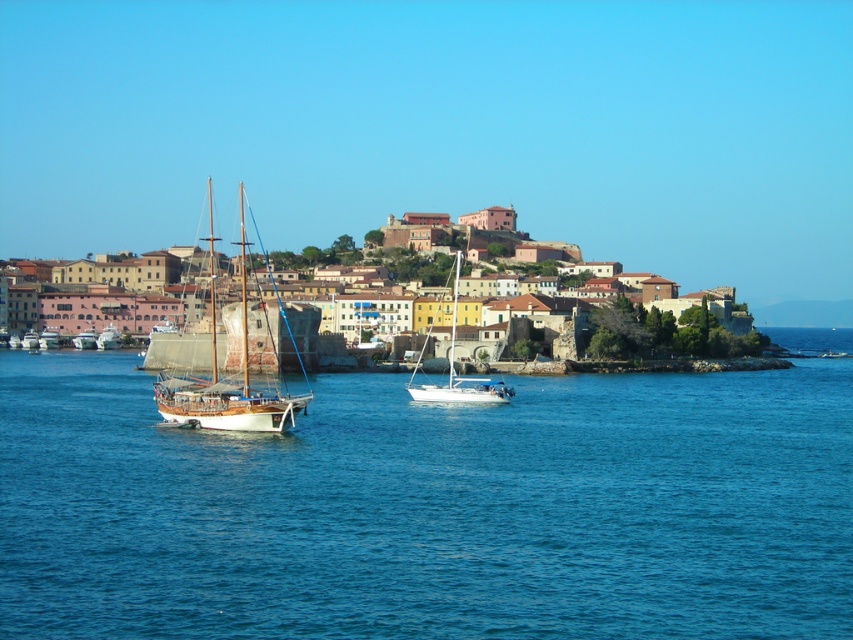
Can you confirm if blue water at center is taller than wooden polished sailboat at left?

No.

Does blue water at center appear under wooden polished sailboat at left?

Yes, blue water at center is below wooden polished sailboat at left.

This screenshot has width=853, height=640. What do you see at coordinates (430, 508) in the screenshot? I see `blue water at center` at bounding box center [430, 508].

Identify the location of blue water at center. This screenshot has height=640, width=853. (430, 508).

Can you confirm if blue water at center is positioned to the right of white glossy sailboat at center?

Yes, blue water at center is to the right of white glossy sailboat at center.

Can you confirm if blue water at center is positioned below white glossy sailboat at center?

Correct, blue water at center is located below white glossy sailboat at center.

Locate an element on the screen. This screenshot has height=640, width=853. blue water at center is located at coordinates (430, 508).

At what (x,y) coordinates should I click in order to perform the action: click on blue water at center. Please return your answer as a coordinate pair (x, y). Image resolution: width=853 pixels, height=640 pixels. Looking at the image, I should click on (430, 508).

Between brick stone buildings at center and white glossy sailboat at center, which one is positioned higher?

brick stone buildings at center is above.

I want to click on brick stone buildings at center, so click(x=672, y=333).

Which is behind, point (250, 216) or point (415, 369)?

Positioned behind is point (250, 216).

This screenshot has height=640, width=853. In order to click on brick stone buildings at center in this screenshot , I will do `click(672, 333)`.